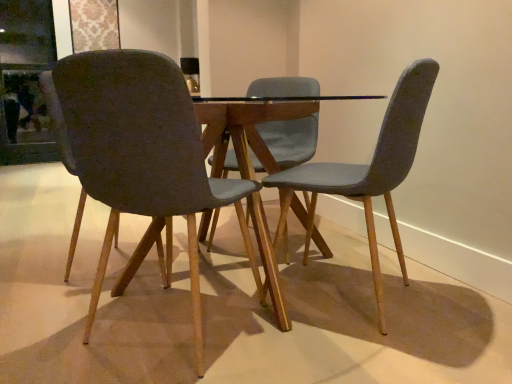
You are a GUI agent. You are given a task and a screenshot of the screen. Output one action in this format:
    pyautogui.click(x=<x>, y=<y>)
    Task: Click on the unoccupied region to the right of textured gray chair at left, which is the 2th chair in right-to-left order
    This screenshot has width=512, height=384.
    Given the screenshot: What is the action you would take?
    pyautogui.click(x=315, y=353)